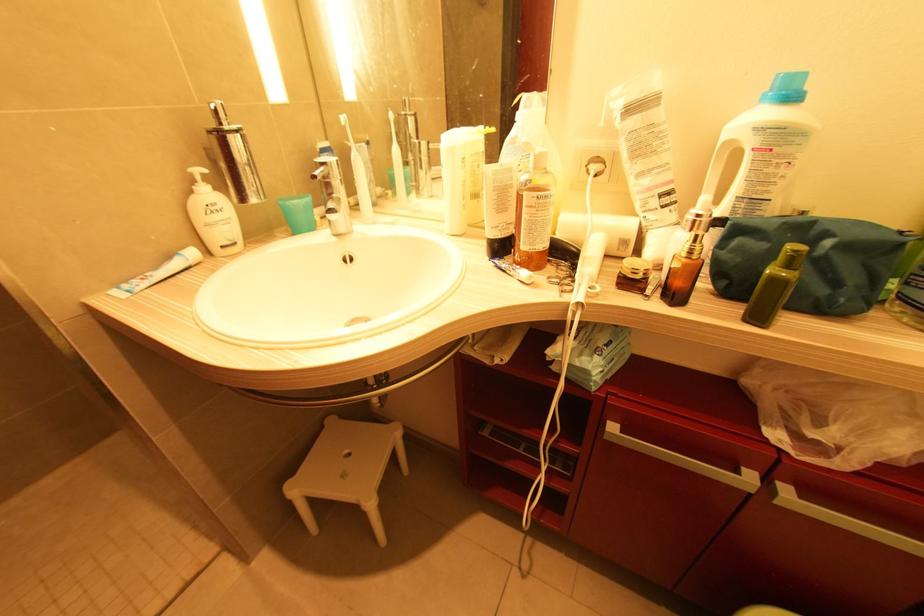
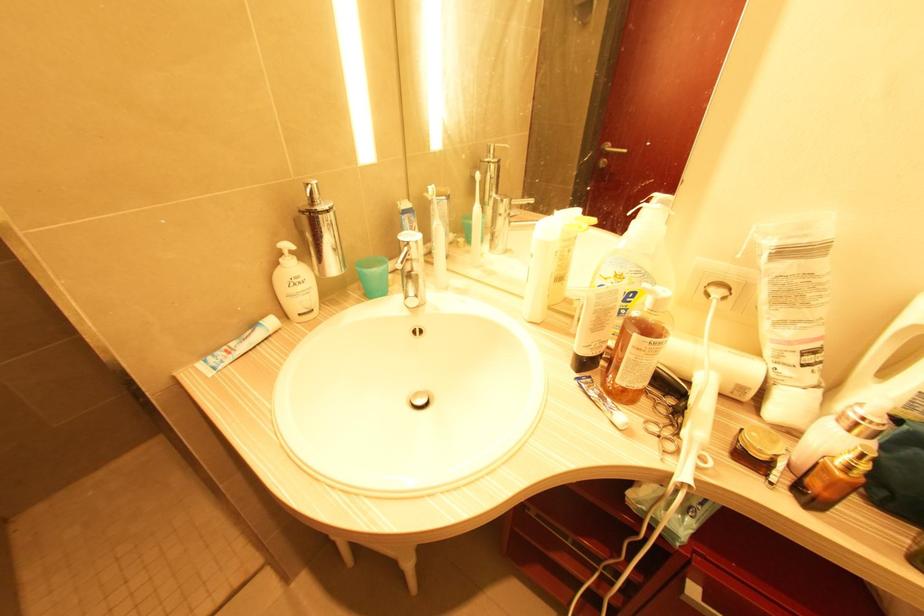
In the second image, find the point that corresponds to [478,164] in the first image.

(569, 249)